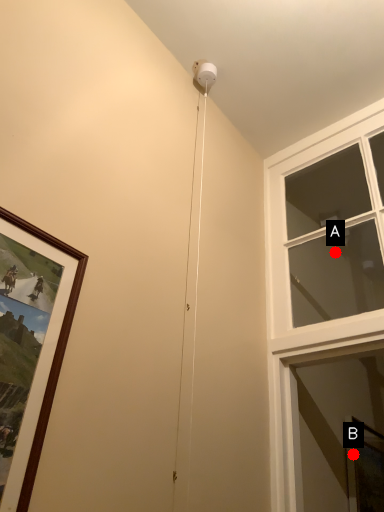
Question: Two points are circled on the image, labeled by A and B beside each circle. Which point is closer to the camera?

Choices:
 (A) A is closer
 (B) B is closer

Answer: (B)